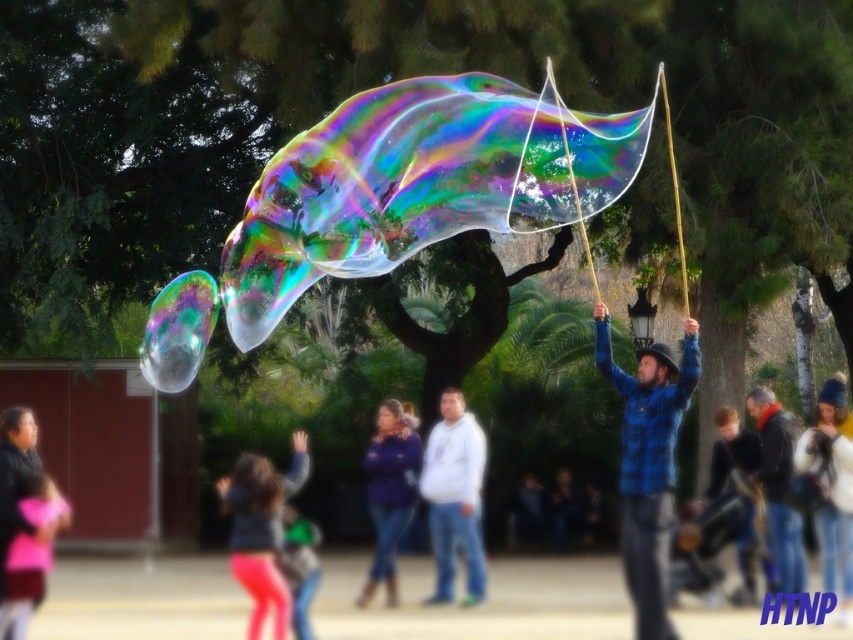
Is pink fabric pants at lower left shorter than dark blue flannel shirt at center?

No, pink fabric pants at lower left is not shorter than dark blue flannel shirt at center.

This screenshot has width=853, height=640. What do you see at coordinates (260, 529) in the screenshot?
I see `pink fabric pants at lower left` at bounding box center [260, 529].

I want to click on pink fabric pants at lower left, so click(x=260, y=529).

Is point (646, 481) less distant than point (395, 588)?

That is True.

Does blue plaid shirt at center come behind blue denim jeans at center?

No, it is not.

Identify the location of blue plaid shirt at center. (648, 461).

Is pink fabric pants at lower left bigger than pink fabric at lower left?

Yes.

Who is shorter, pink fabric pants at lower left or pink fabric at lower left?

With less height is pink fabric at lower left.

Who is more forward, (277, 584) or (32, 499)?

Point (32, 499) is in front.

Identify the location of pink fabric pants at lower left. (260, 529).